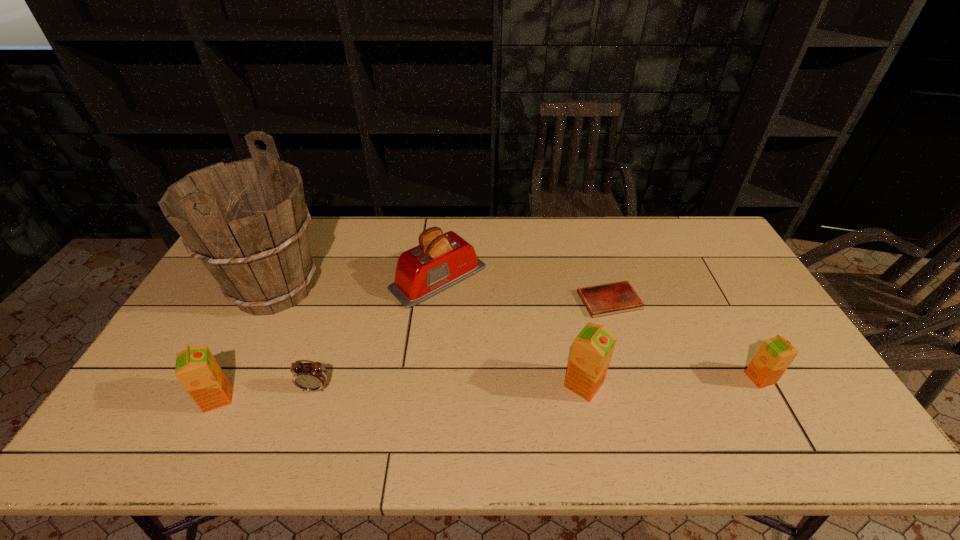
Locate an element on the screen. This screenshot has width=960, height=540. orange juice that stands as the closest to the shortest orange juice is located at coordinates (592, 349).

What are the coordinates of `vacant space that satisfies the following two spatial constraints: 1. on the back side of the second shortest orange juice; 2. on the left side of the fourth object from left to right` in the screenshot? It's located at (278, 278).

The width and height of the screenshot is (960, 540). Identify the location of vacant space that satisfies the following two spatial constraints: 1. on the front side of the shortest object; 2. on the right side of the fourth object from left to right. (436, 300).

In order to click on blank space that satisfies the following two spatial constraints: 1. on the back side of the tallest object; 2. on the left side of the leftmost orange juice in this screenshot , I will do `click(273, 288)`.

Image resolution: width=960 pixels, height=540 pixels. In order to click on vacant area in the image that satisfies the following two spatial constraints: 1. on the back side of the second orange juice from right to left; 2. on the right side of the leftmost orange juice in this screenshot , I will do `click(225, 384)`.